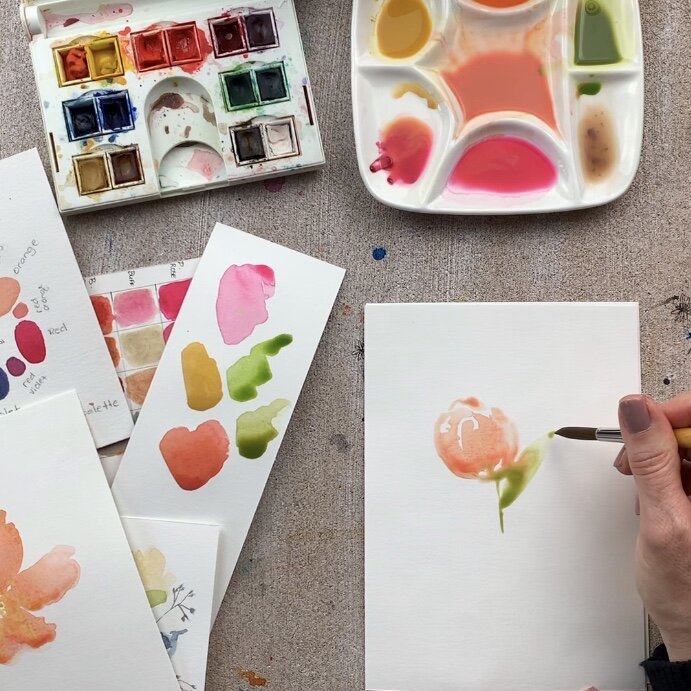
You are a GUI agent. You are given a task and a screenshot of the screen. Output one action in this format:
    pyautogui.click(x=<x>, y=<y>)
    Task: Click on the grey table
    
    Given the screenshot: What is the action you would take?
    pyautogui.click(x=334, y=216)